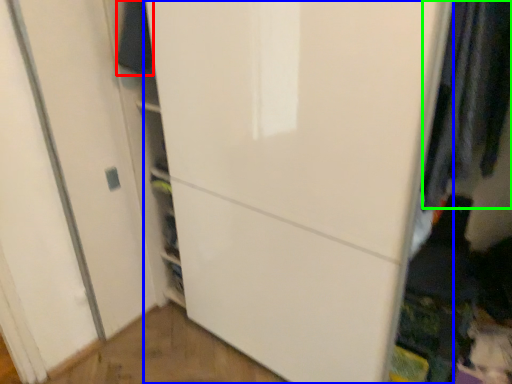
Question: Estimate the real-world distances between objects in this image. Which object is closer to clothing (highlighted by a red box), door (highlighted by a blue box) or clothing (highlighted by a green box)?

Choices:
 (A) door
 (B) clothing

Answer: (A)